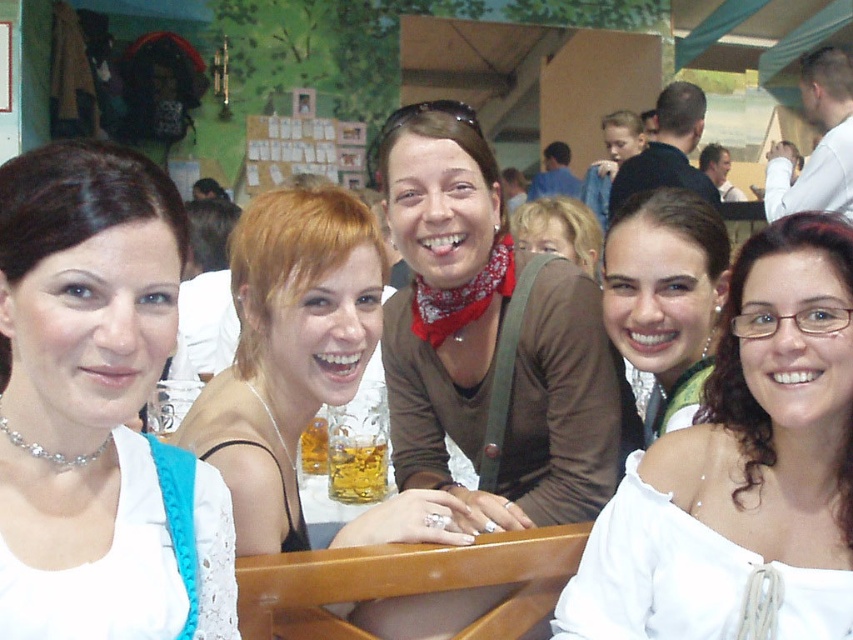
Does blonde hair at center have a greater height compared to matte brown sweater at center?

Yes.

Looking at this image, is blonde hair at center below matte brown sweater at center?

Yes, blonde hair at center is below matte brown sweater at center.

Does point (291, 314) lie in front of point (534, 198)?

Yes, point (291, 314) is closer to viewer.

This screenshot has width=853, height=640. What are the coordinates of `blonde hair at center` in the screenshot? It's located at (287, 349).

Between matte brown hair at center and translucent glass cup at center, which one is positioned lower?

translucent glass cup at center is lower down.

This screenshot has width=853, height=640. Describe the element at coordinates (665, 292) in the screenshot. I see `matte brown hair at center` at that location.

The height and width of the screenshot is (640, 853). What are the coordinates of `matte brown hair at center` in the screenshot? It's located at (665, 292).

At what (x,y) coordinates should I click in order to perform the action: click on matte brown hair at center. Please return your answer as a coordinate pair (x, y). Looking at the image, I should click on (665, 292).

Is matte brown sweater at center smaller than translucent glass beer at center?

No, matte brown sweater at center is not smaller than translucent glass beer at center.

Is point (569, 259) farther from camera compared to point (321, 420)?

That is True.

At what (x,y) coordinates should I click in order to perform the action: click on matte brown sweater at center. Please return your answer as a coordinate pair (x, y). This screenshot has height=640, width=853. Looking at the image, I should click on (560, 230).